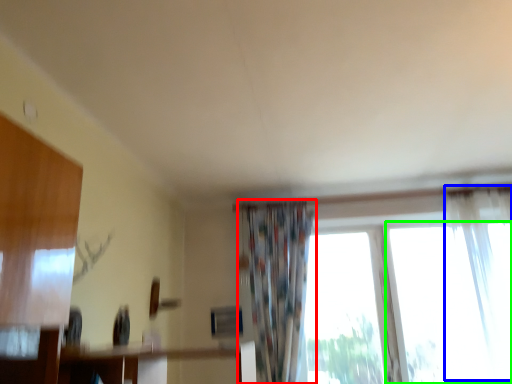
Question: Considering the real-world distances, which object is closest to curtain (highlighted by a red box)? curtain (highlighted by a blue box) or window (highlighted by a green box).

Choices:
 (A) curtain
 (B) window

Answer: (B)